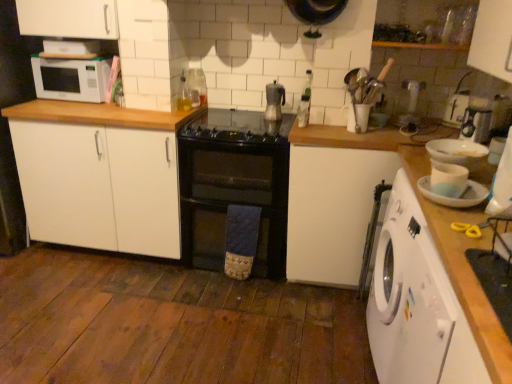
Question: Is clear glass bottle at upper center, the second appliance in the front-to-back sequence, smaller than white matte microwave at upper left?

Choices:
 (A) yes
 (B) no

Answer: (A)

Question: From a real-world perspective, is clear glass bottle at upper center, acting as the second appliance starting from the left, physically below white matte microwave at upper left?

Choices:
 (A) yes
 (B) no

Answer: (A)

Question: From the image's perspective, is clear glass bottle at upper center, which is the 2th appliance in right-to-left order, on white matte microwave at upper left?

Choices:
 (A) yes
 (B) no

Answer: (B)

Question: From the image's perspective, would you say clear glass bottle at upper center, acting as the second appliance starting from the left, is shown under white matte microwave at upper left?

Choices:
 (A) no
 (B) yes

Answer: (B)

Question: Is clear glass bottle at upper center, the 2th appliance viewed from the top, oriented towards white matte microwave at upper left?

Choices:
 (A) yes
 (B) no

Answer: (A)

Question: Is white matte microwave at upper left a part of clear glass bottle at upper center, arranged as the 2th appliance when ordered from the bottom?

Choices:
 (A) yes
 (B) no

Answer: (B)

Question: Does white plastic washing machine at right appear on the right side of white glossy mug at upper right, the first appliance when ordered from front to back?

Choices:
 (A) no
 (B) yes

Answer: (B)

Question: From the image's perspective, would you say white plastic washing machine at right is shown under white glossy mug at upper right, placed as the first appliance when sorted from right to left?

Choices:
 (A) no
 (B) yes

Answer: (B)

Question: Is white plastic washing machine at right shorter than white glossy mug at upper right, which is counted as the 3th appliance, starting from the left?

Choices:
 (A) no
 (B) yes

Answer: (A)

Question: Is white plastic washing machine at right closer to camera compared to white glossy mug at upper right, placed as the first appliance when sorted from right to left?

Choices:
 (A) yes
 (B) no

Answer: (B)

Question: Considering the relative sizes of white plastic washing machine at right and white glossy mug at upper right, arranged as the 1th appliance when ordered from the bottom, in the image provided, is white plastic washing machine at right taller than white glossy mug at upper right, arranged as the 1th appliance when ordered from the bottom,?

Choices:
 (A) no
 (B) yes

Answer: (B)

Question: Is white plastic washing machine at right at the left side of white glossy mug at upper right, placed as the first appliance when sorted from right to left?

Choices:
 (A) yes
 (B) no

Answer: (B)

Question: Considering the relative positions of black glass gas stove at center and white matte countertop at right in the image provided, is black glass gas stove at center to the left of white matte countertop at right from the viewer's perspective?

Choices:
 (A) yes
 (B) no

Answer: (A)